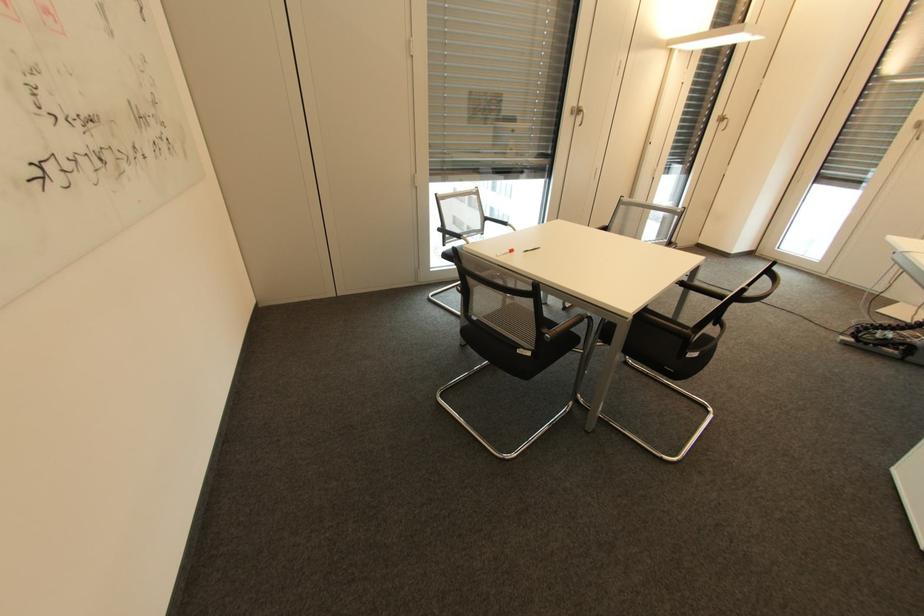
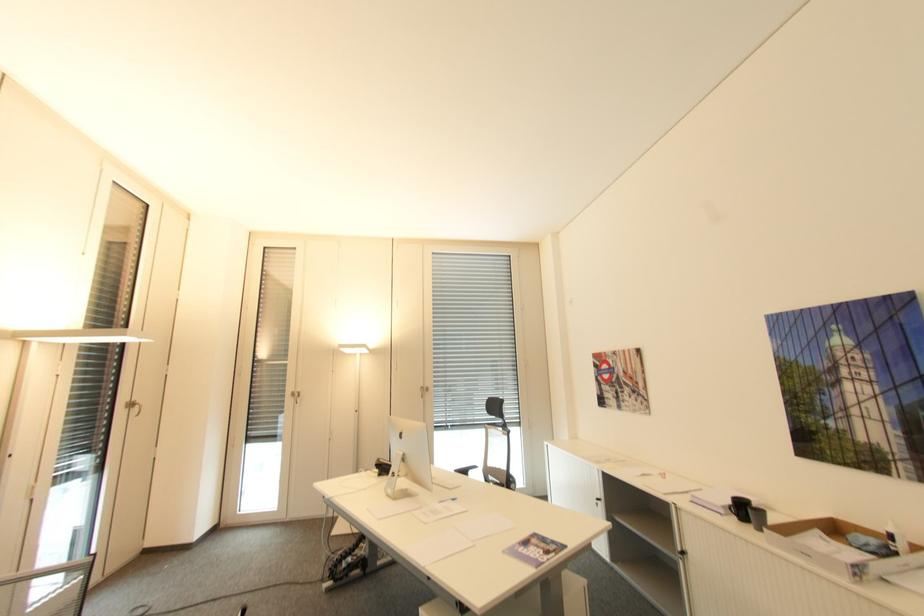
Question: The first image is from the beginning of the video and the second image is from the end. How did the camera likely rotate when shooting the video?

Choices:
 (A) Left
 (B) Right
 (C) Up
 (D) Down

Answer: (B)